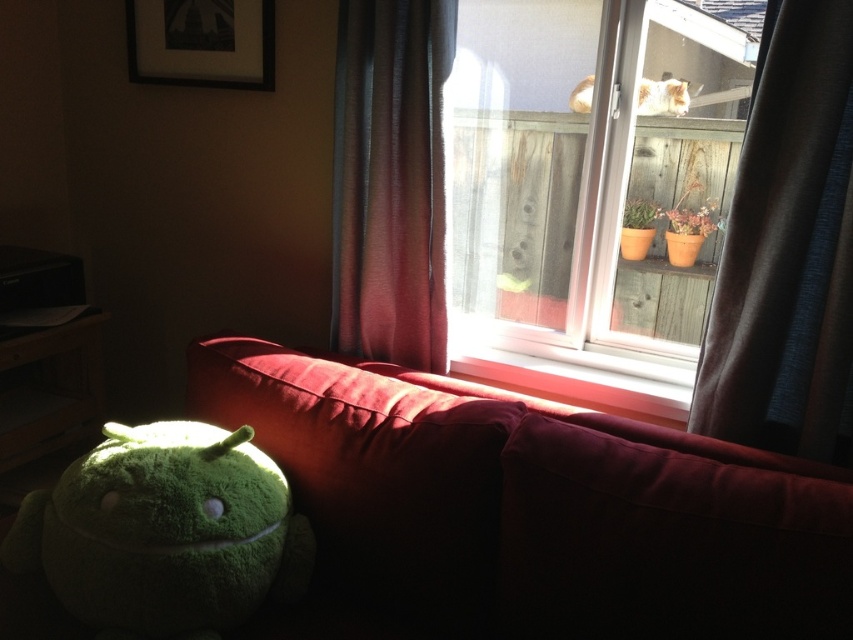
Question: Considering the real-world distances, which object is farthest from the white fluffy cat at upper center?

Choices:
 (A) velvet-like burgundy curtain at center
 (B) green plush toy at lower left
 (C) dark gray fabric curtain at right
 (D) velvet red couch at lower left

Answer: (B)

Question: Considering the relative positions of transparent glass window at upper center and smooth wood window sill at center in the image provided, where is transparent glass window at upper center located with respect to smooth wood window sill at center?

Choices:
 (A) below
 (B) above

Answer: (B)

Question: Does dark gray fabric curtain at right appear on the left side of velvet-like burgundy curtain at center?

Choices:
 (A) yes
 (B) no

Answer: (B)

Question: Is velvet red couch at lower left bigger than green plush toy at lower left?

Choices:
 (A) no
 (B) yes

Answer: (B)

Question: Which point is closer to the camera?

Choices:
 (A) (579, 26)
 (B) (648, 100)

Answer: (B)

Question: Which object is positioned farthest from the green plush toy at lower left?

Choices:
 (A) white fluffy cat at upper center
 (B) velvet red couch at lower left
 (C) velvet-like burgundy curtain at center

Answer: (A)